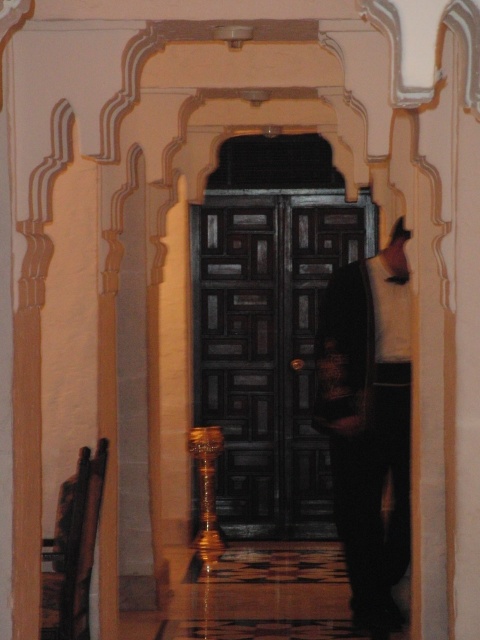
You are a painter standing in front of the dark wood door at center and the dark brown leather jacket at center. You want to hang a painting on the wall between them. Which object should you consider the width of to ensure the painting fits properly?

The dark wood door at center is wider than the dark brown leather jacket at center. Therefore, you should consider the width of the dark wood door at center to ensure the painting fits properly between them.